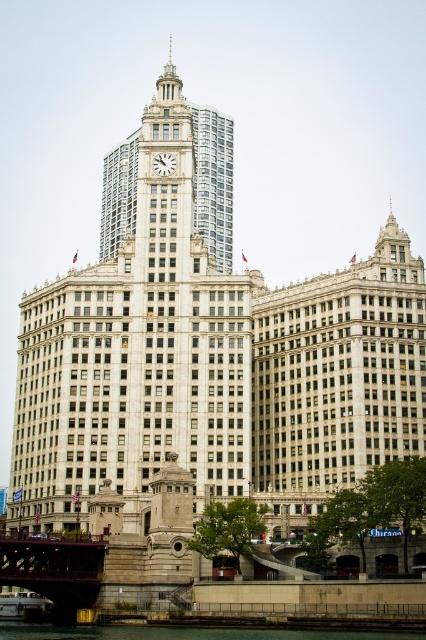
Is point (55, 584) in front of point (209, 634)?

That is False.

Consider the image. Is brown metal bridge at lower left smaller than green concrete river at lower center?

Indeed, brown metal bridge at lower left has a smaller size compared to green concrete river at lower center.

Describe the element at coordinates (54, 570) in the screenshot. I see `brown metal bridge at lower left` at that location.

This screenshot has height=640, width=426. I want to click on brown metal bridge at lower left, so click(54, 570).

Does point (218, 243) lie behind point (26, 538)?

Yes, point (218, 243) is behind point (26, 538).

Can you confirm if white marble clock tower at center is positioned to the left of brown metal bridge at lower left?

Incorrect, white marble clock tower at center is not on the left side of brown metal bridge at lower left.

Between point (215, 186) and point (43, 572), which one is positioned behind?

Positioned behind is point (215, 186).

The height and width of the screenshot is (640, 426). Find the location of `white marble clock tower at center`. white marble clock tower at center is located at coordinates (213, 182).

Who is shorter, white marble clock tower at center or green concrete river at lower center?

With less height is green concrete river at lower center.

Is white marble clock tower at center to the right of green concrete river at lower center from the viewer's perspective?

In fact, white marble clock tower at center is to the left of green concrete river at lower center.

Is point (135, 182) positioned in front of point (296, 628)?

No.

The width and height of the screenshot is (426, 640). I want to click on white marble clock tower at center, so click(x=213, y=182).